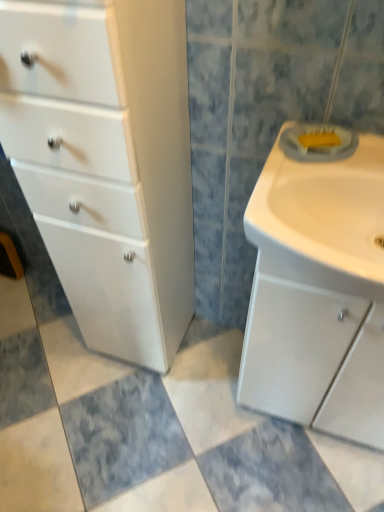
This screenshot has width=384, height=512. What are the coordinates of `vacant area that is in front of white matte sink cabinet at right` in the screenshot? It's located at (309, 474).